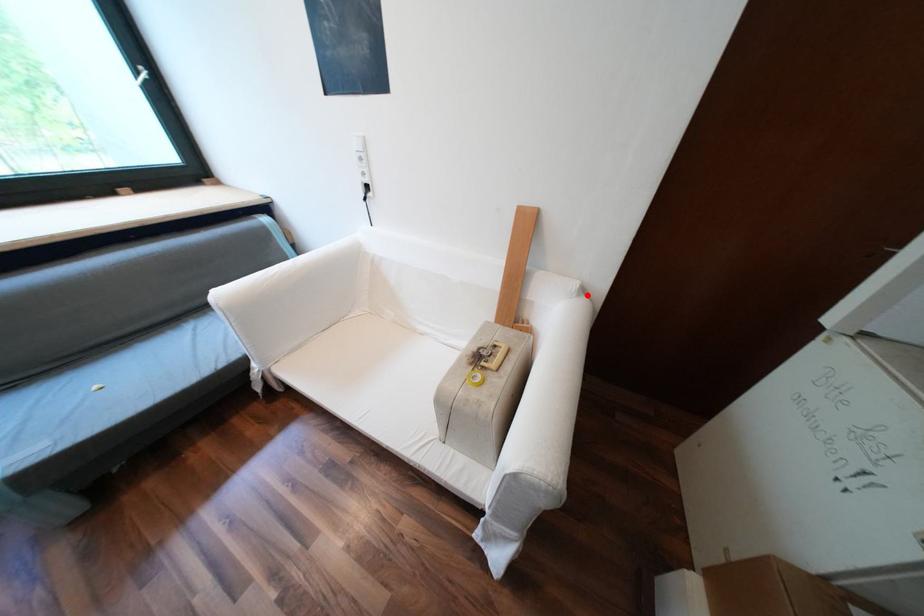
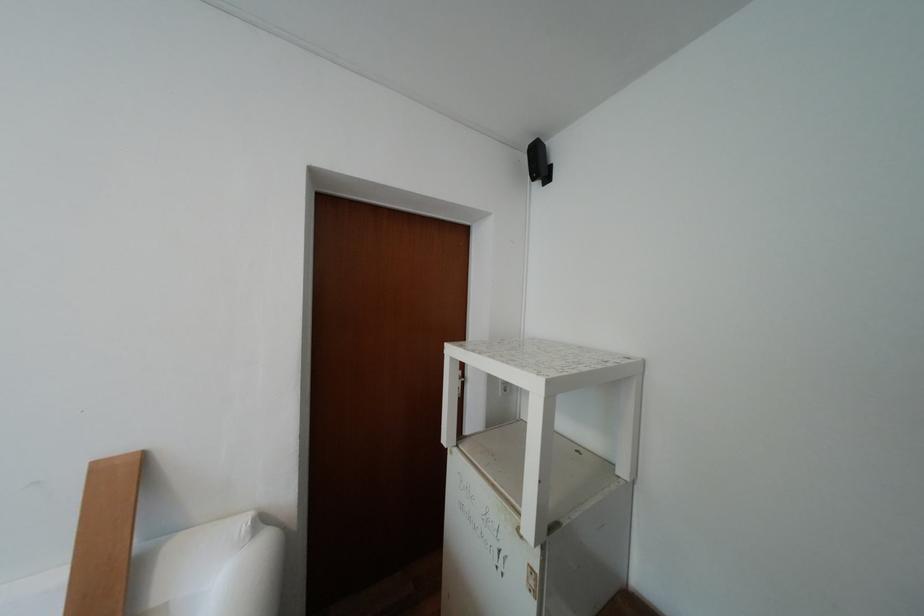
The point at the highlighted location is marked in the first image. Where is the corresponding point in the second image?

(263, 535)